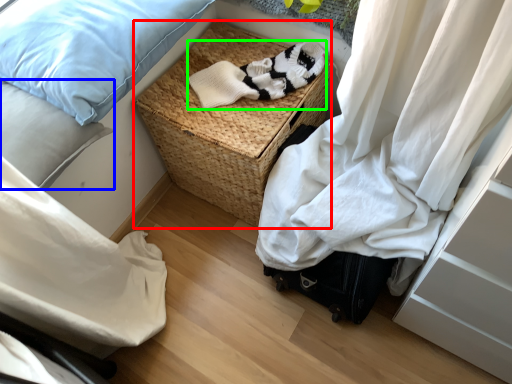
Question: Which object is the farthest from picnic basket (highlighted by a red box)? Choose among these: pillow (highlighted by a blue box) or clothing (highlighted by a green box).

Choices:
 (A) pillow
 (B) clothing

Answer: (A)